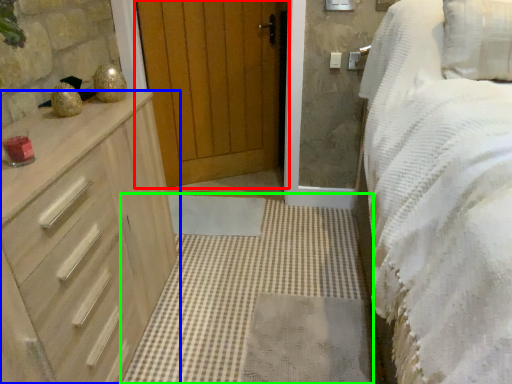
Question: Considering the real-world distances, which object is closest to door (highlighted by a red box)? chest of drawers (highlighted by a blue box) or plain (highlighted by a green box).

Choices:
 (A) chest of drawers
 (B) plain

Answer: (B)